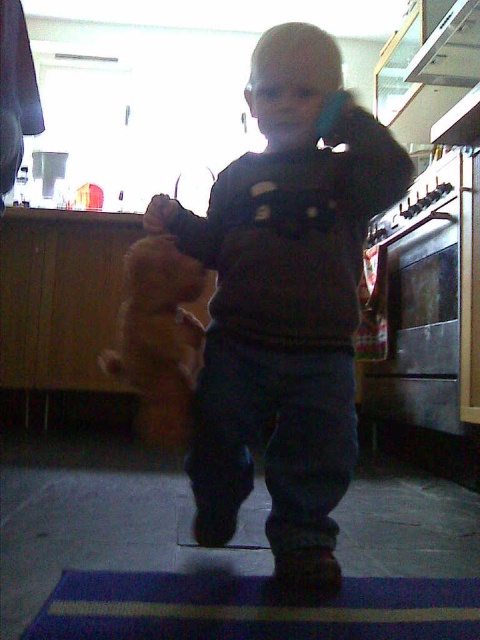
Question: Does dark gray sweater at center appear under white glossy exhaust hood at upper right?

Choices:
 (A) yes
 (B) no

Answer: (A)

Question: Estimate the real-world distances between objects in this image. Which object is farther from the dark gray sweater at center?

Choices:
 (A) white glossy exhaust hood at upper right
 (B) blue striped rug at lower center

Answer: (A)

Question: From the image, what is the correct spatial relationship of dark gray sweater at center in relation to white glossy exhaust hood at upper right?

Choices:
 (A) below
 (B) above

Answer: (A)

Question: Among these points, which one is nearest to the camera?

Choices:
 (A) (97, 605)
 (B) (240, 394)

Answer: (A)

Question: Considering the relative positions of dark gray sweater at center and blue striped rug at lower center in the image provided, where is dark gray sweater at center located with respect to blue striped rug at lower center?

Choices:
 (A) above
 (B) below

Answer: (A)

Question: Which point appears farthest from the camera in this image?

Choices:
 (A) (459, 586)
 (B) (429, 51)
 (C) (252, 164)

Answer: (B)